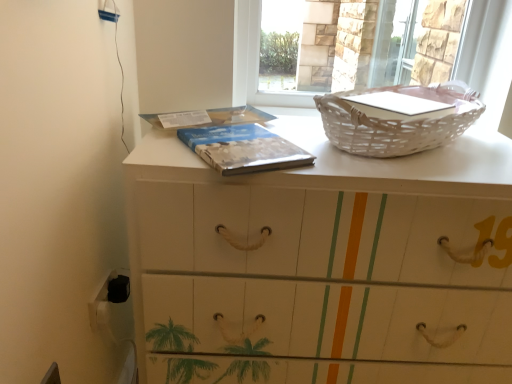
Identify the location of vacant location behind blue textured book at center. (286, 124).